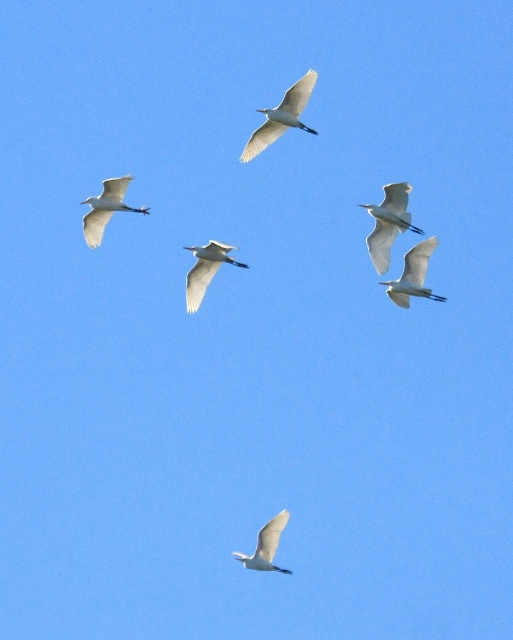
Measure the distance between point (377, 216) and camera.

A distance of 289.34 feet exists between point (377, 216) and camera.

Does white feathered bird at upper right have a lesser width compared to white matte bird at center?

Yes, white feathered bird at upper right is thinner than white matte bird at center.

Between point (405, 188) and point (201, 276), which one is positioned behind?

Positioned behind is point (201, 276).

Identify the location of white feathered bird at upper right. The image size is (513, 640). (388, 224).

Can you confirm if white feathered bird at upper center is positioned above white matte bird at center?

Yes.

Does white feathered bird at upper center appear under white matte bird at center?

No.

Describe the element at coordinates (282, 116) in the screenshot. This screenshot has width=513, height=640. I see `white feathered bird at upper center` at that location.

Image resolution: width=513 pixels, height=640 pixels. Find the location of `white feathered bird at upper center`. white feathered bird at upper center is located at coordinates (282, 116).

Between white feathered bird at upper center and white feathered bird at center, which one has more height?

Standing taller between the two is white feathered bird at upper center.

Based on the photo, which is more to the left, white feathered bird at upper center or white feathered bird at center?

From the viewer's perspective, white feathered bird at upper center appears more on the left side.

Which is behind, point (246, 154) or point (406, 278)?

Positioned behind is point (246, 154).

The height and width of the screenshot is (640, 513). In order to click on white feathered bird at upper center in this screenshot , I will do `click(282, 116)`.